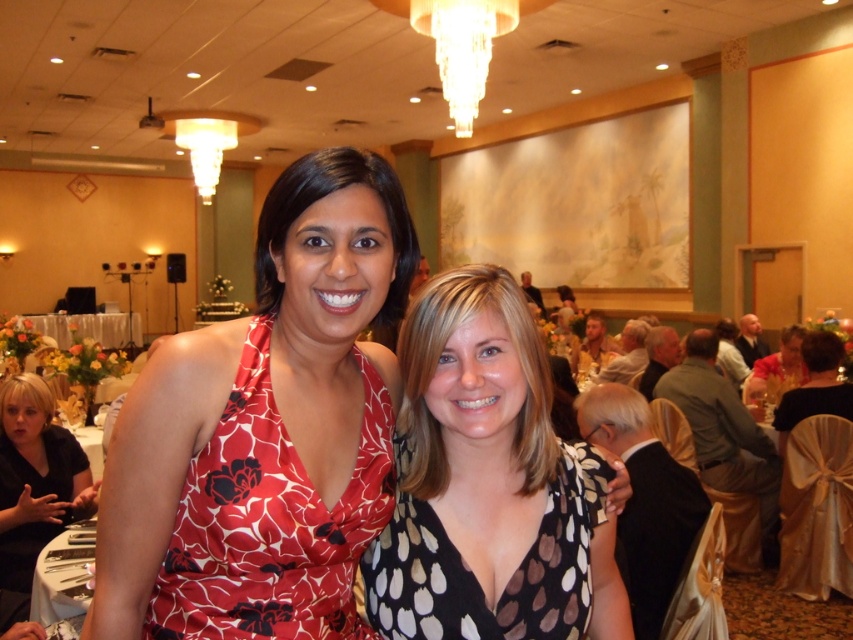
Is black dotted dress at center to the right of black matte dress at lower left from the viewer's perspective?

Yes, black dotted dress at center is to the right of black matte dress at lower left.

Can you confirm if black dotted dress at center is positioned to the left of black matte dress at lower left?

Incorrect, black dotted dress at center is not on the left side of black matte dress at lower left.

Between point (386, 548) and point (4, 410), which one is positioned in front?

Positioned in front is point (386, 548).

Where is `black dotted dress at center`? The image size is (853, 640). black dotted dress at center is located at coordinates (474, 576).

Is floral print dress at center behind red floral fabric dress at center?

That is False.

Where is `floral print dress at center`? The width and height of the screenshot is (853, 640). floral print dress at center is located at coordinates (265, 429).

Locate an element on the screen. The height and width of the screenshot is (640, 853). floral print dress at center is located at coordinates (265, 429).

Can you confirm if red floral fabric dress at center is shorter than black matte dress at lower left?

Indeed, red floral fabric dress at center has a lesser height compared to black matte dress at lower left.

Which is more to the right, red floral fabric dress at center or black matte dress at lower left?

red floral fabric dress at center

Who is more forward, (265,432) or (51,531)?

Point (265,432) is in front.

Identify the location of red floral fabric dress at center. The width and height of the screenshot is (853, 640). (271, 520).